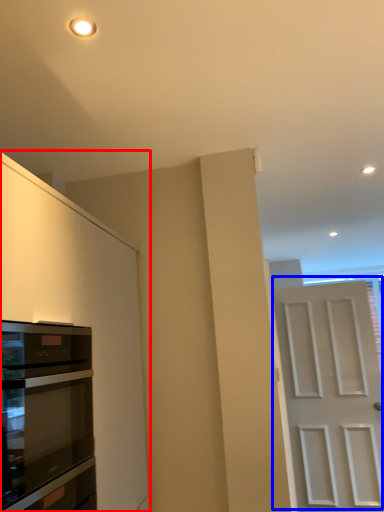
Question: Among these objects, which one is nearest to the camera, cabinetry (highlighted by a red box) or door (highlighted by a blue box)?

Choices:
 (A) cabinetry
 (B) door

Answer: (A)